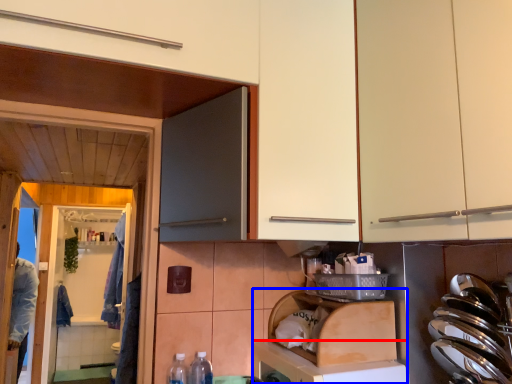
Question: Among these objects, which one is nearest to the camera, dish washer (highlighted by a red box) or dish washer (highlighted by a blue box)?

Choices:
 (A) dish washer
 (B) dish washer

Answer: (A)